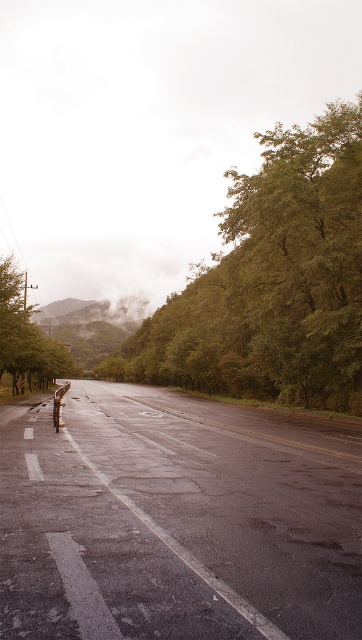
You are standing at the camera position and want to walk to point (302, 316). Is the distance more than 30 meters?

The distance between point (302, 316) and the camera is 32.74 meters, so yes, the distance is more than 30 meters.

You are a hiker walking along the road and want to take a photo of both the green leafy tree at center and the green leafy tree at left. Which tree should you stand closer to in order to capture both in a single frame?

To capture both the green leafy tree at center and the green leafy tree at left in a single frame, you should stand closer to the green leafy tree at left since it is shorter than the green leafy tree at center, allowing you to include both within the camera view.